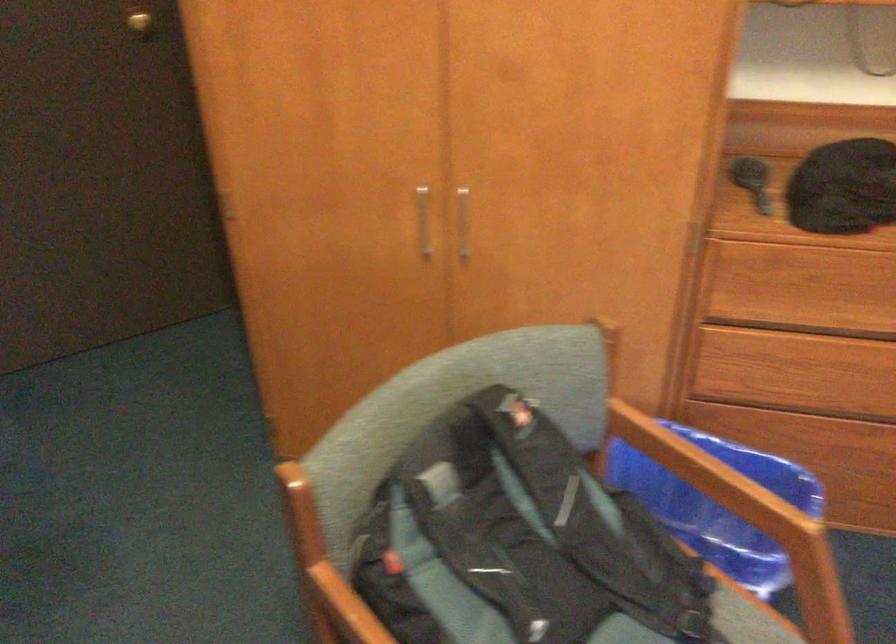
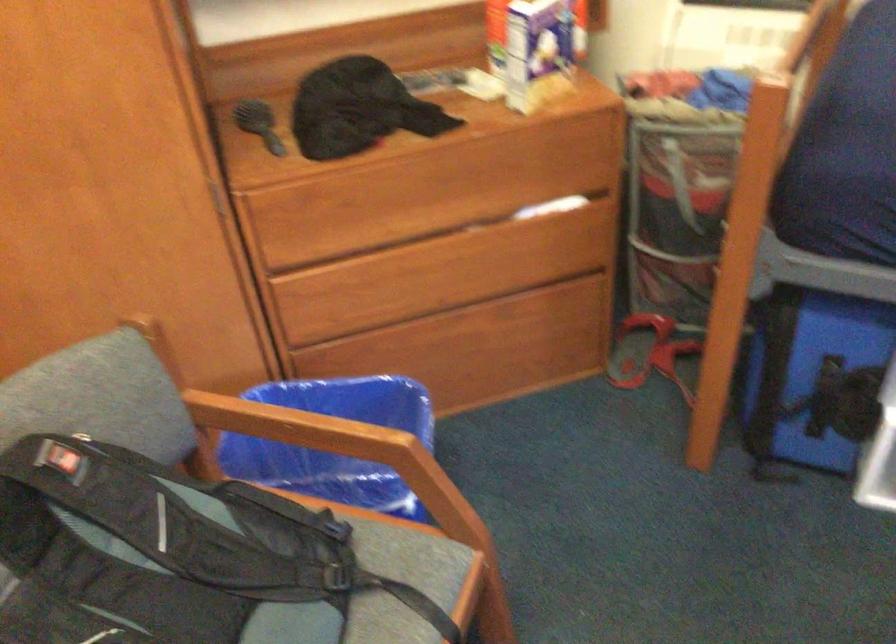
Question: The camera is either moving clockwise (left) or counter-clockwise (right) around the object. The first image is from the beginning of the video and the second image is from the end. Is the camera moving left or right when shooting the video?

Choices:
 (A) Left
 (B) Right

Answer: (A)